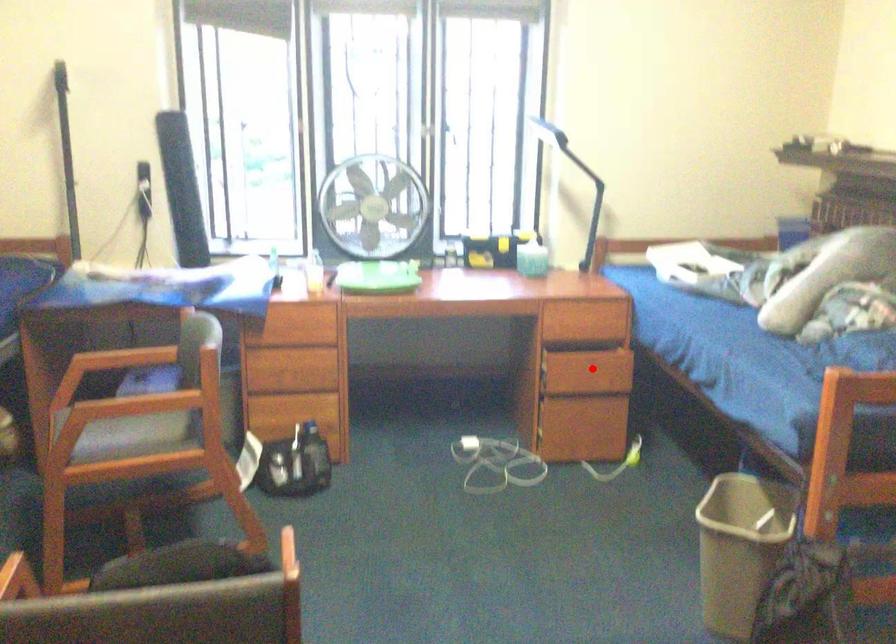
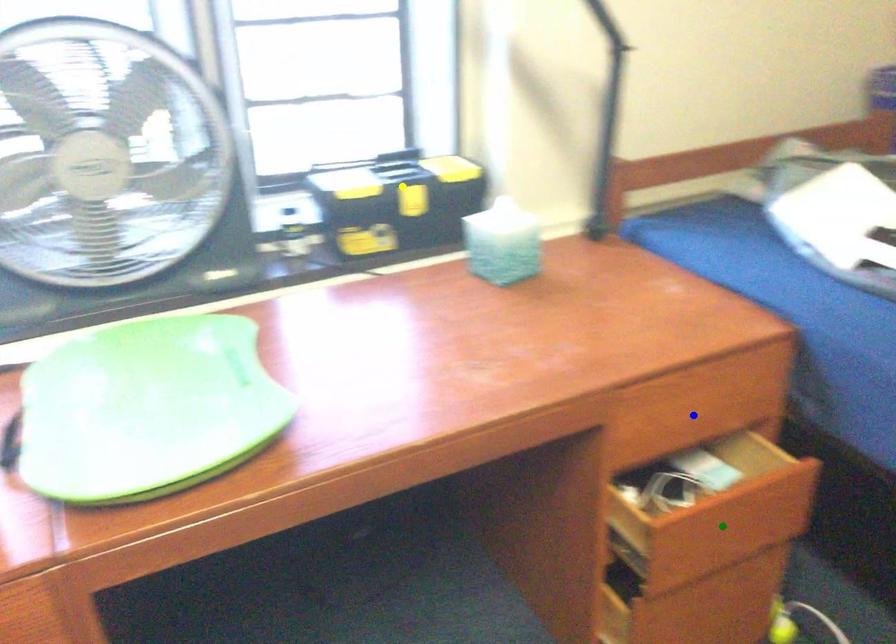
Question: I am providing you with two images of the same scene from different viewpoints. A red point is marked on the first image. You are given multiple points on the second image. Which mark in image 2 goes with the point in image 1?

Choices:
 (A) green point
 (B) yellow point
 (C) blue point

Answer: (A)